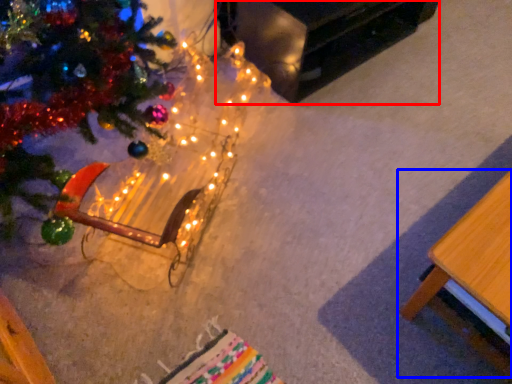
Question: Which of the following is the closest to the observer, table (highlighted by a red box) or table (highlighted by a blue box)?

Choices:
 (A) table
 (B) table

Answer: (B)